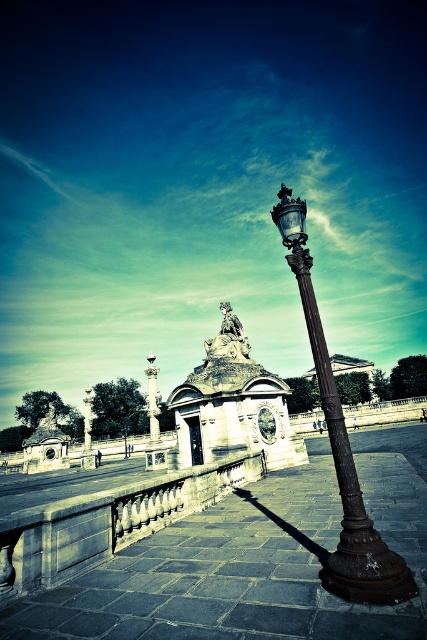
Who is shorter, bronze textured street light at center or smooth white column at center?

With less height is bronze textured street light at center.

Which is behind, point (380, 541) or point (155, 369)?

The point (155, 369) is behind.

Find the location of a particular element. bronze textured street light at center is located at coordinates (341, 449).